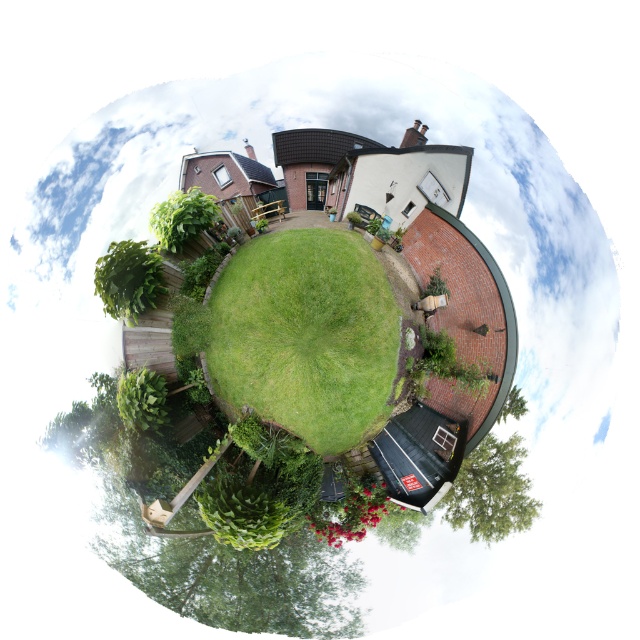
You are a landscape architect designing a garden layout. You need to place a tall statue between the green leafy tree at upper left and the green leafy tree at center. Which tree should the statue be closer to in order to balance the visual height?

The statue should be closer to the green leafy tree at center since the green leafy tree at upper left is taller, and positioning the statue nearer to the shorter tree would help balance the visual height.

You are a gardener who needs to water both the green grass at center and the green leafy tree at lower right. If your watering can has a range of 8 feet, can you water both areas without moving the can?

The green grass at center and green leafy tree at lower right are 8.55 feet apart. Since the watering can has a range of only 8 feet, you cannot water both areas without moving the can because the distance between them exceeds the can range.

You are standing on the lawn and want to take a photo of the green leafy tree at upper left and the green leafy tree at center. Which tree will appear closer to you in the photo?

The green leafy tree at upper left will appear closer to you in the photo because it is in front of the green leafy tree at center.